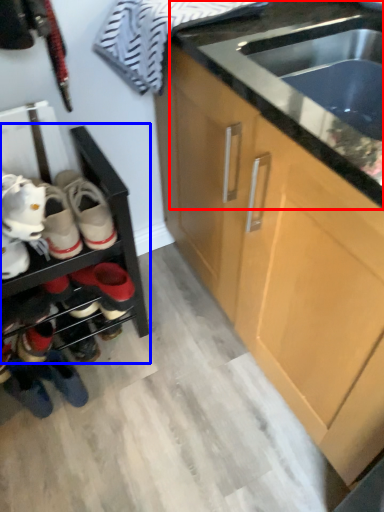
Question: Which object is further to the camera taking this photo, countertop (highlighted by a red box) or shelf (highlighted by a blue box)?

Choices:
 (A) countertop
 (B) shelf

Answer: (B)